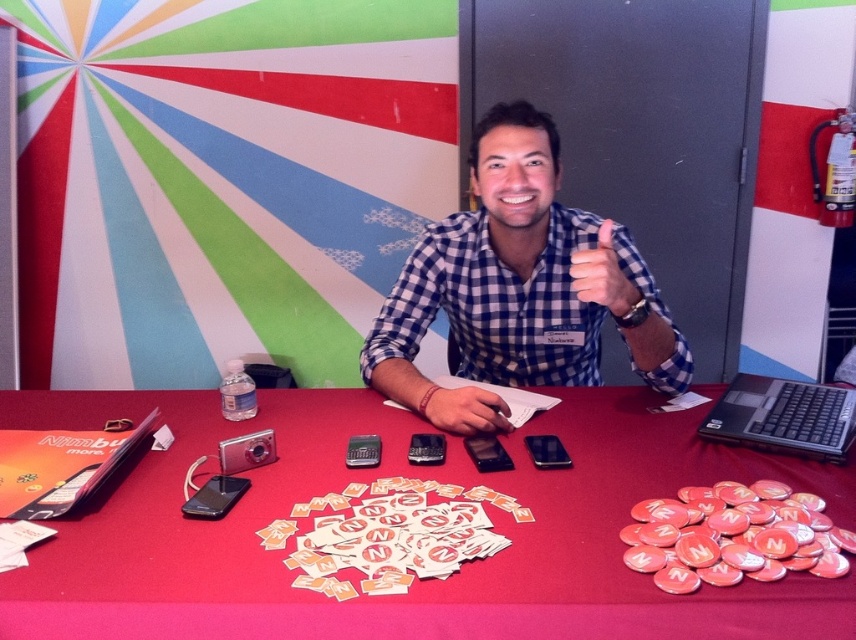
Which is above, red matte table at center or matte black mouse at center?

matte black mouse at center is above.

Does red matte table at center come in front of matte black mouse at center?

Yes, red matte table at center is in front of matte black mouse at center.

What are the coordinates of `red matte table at center` in the screenshot? It's located at (415, 579).

Who is shorter, blue checkered shirt at center or black plastic laptop at right?

Standing shorter between the two is black plastic laptop at right.

Is point (575, 310) less distant than point (738, 419)?

No, it is behind (738, 419).

The width and height of the screenshot is (856, 640). I want to click on blue checkered shirt at center, so click(522, 280).

What do you see at coordinates (390, 536) in the screenshot? I see `white paper at center` at bounding box center [390, 536].

Between white paper at center and black plastic laptop at right, which one appears on the left side from the viewer's perspective?

white paper at center is more to the left.

Image resolution: width=856 pixels, height=640 pixels. What do you see at coordinates (390, 536) in the screenshot?
I see `white paper at center` at bounding box center [390, 536].

I want to click on white paper at center, so click(x=390, y=536).